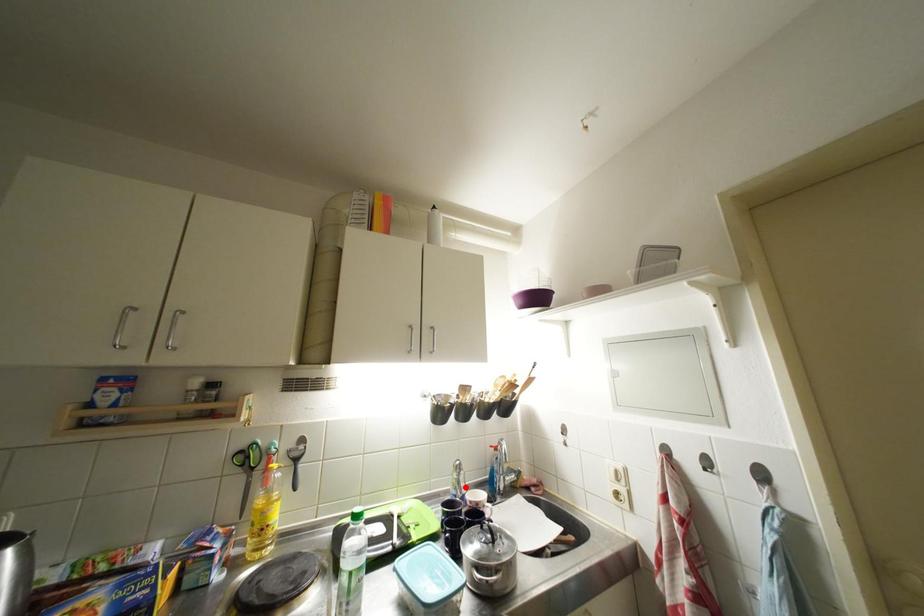
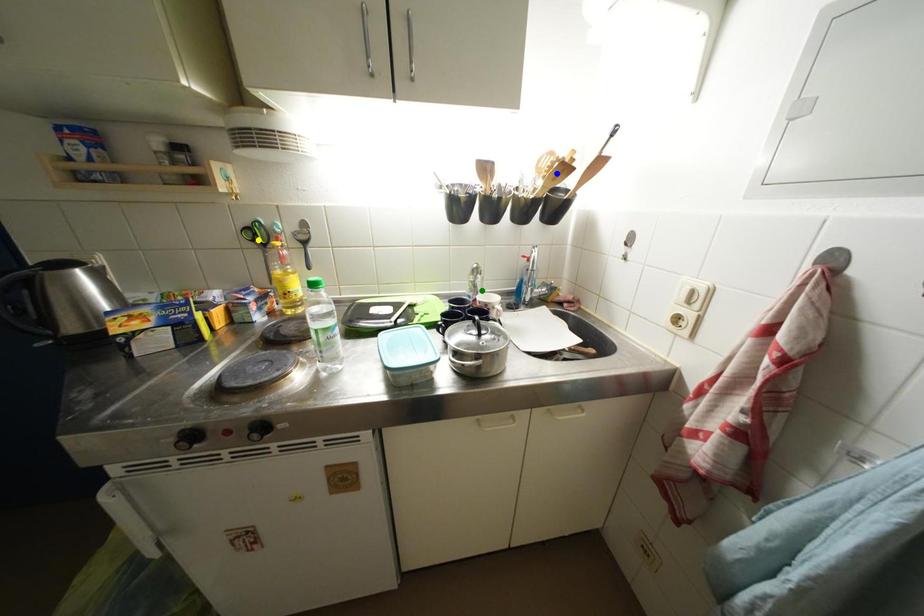
Question: I am providing you with two images of the same scene from different viewpoints. A red point is marked on the first image. You are given multiple points on the second image. In image 2, which mark is for the same physical point as the one in image 1?

Choices:
 (A) yellow point
 (B) blue point
 (C) green point

Answer: (C)